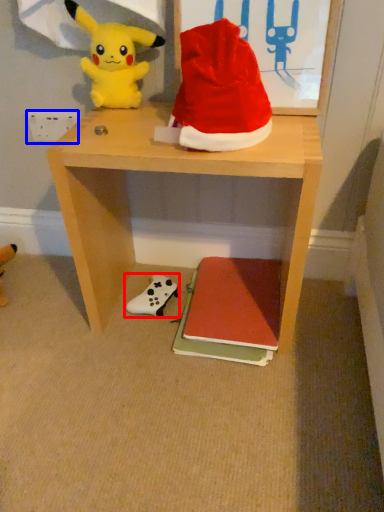
Question: Which object is further to the camera taking this photo, toy (highlighted by a red box) or power outlet (highlighted by a blue box)?

Choices:
 (A) toy
 (B) power outlet

Answer: (B)